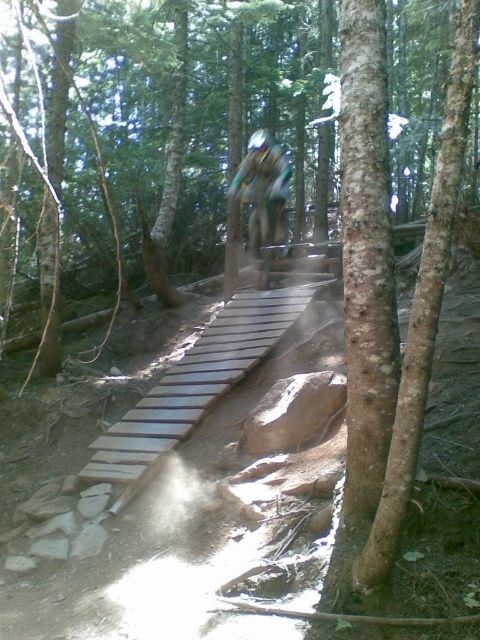
Is light brown wooden ramp at center to the right of camouflage fabric jacket at center from the viewer's perspective?

In fact, light brown wooden ramp at center is to the left of camouflage fabric jacket at center.

Which of these two, light brown wooden ramp at center or camouflage fabric jacket at center, stands taller?

light brown wooden ramp at center

Is point (202, 336) closer to camera compared to point (249, 179)?

Yes, point (202, 336) is closer to viewer.

I want to click on light brown wooden ramp at center, so click(x=195, y=384).